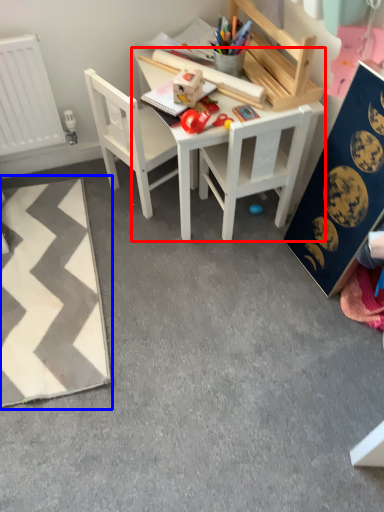
Question: Which object is closer to the camera taking this photo, table (highlighted by a red box) or mat (highlighted by a blue box)?

Choices:
 (A) table
 (B) mat

Answer: (B)